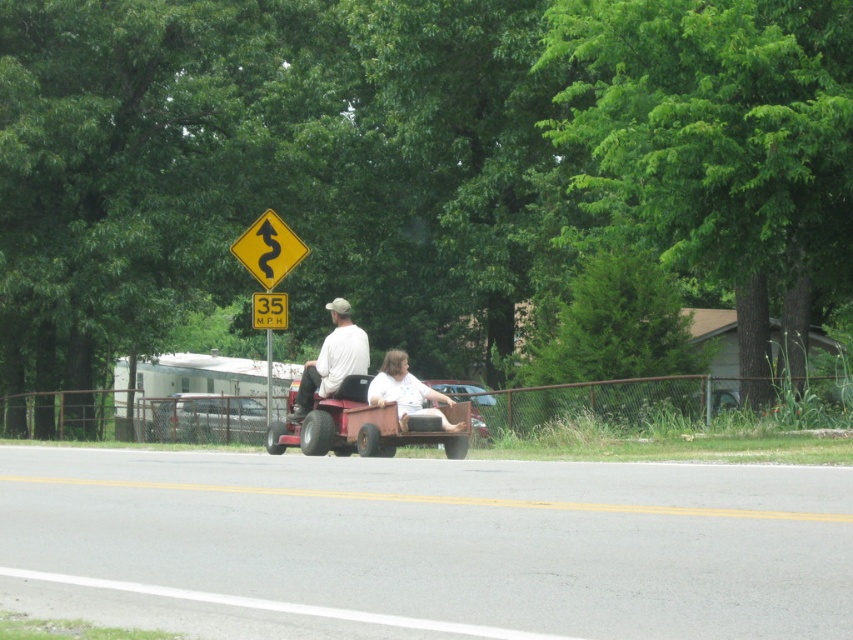
Question: Based on their relative distances, which object is farther from the yellow diamond-shaped road sign at upper center?

Choices:
 (A) white matte shirt at center
 (B) white matte lawn mower at center

Answer: (B)

Question: Estimate the real-world distances between objects in this image. Which object is closer to the yellow diamond-shaped road sign at upper center?

Choices:
 (A) yellowmaterial/texturesign at upper center
 (B) white matte lawn mower at center
 (C) white matte shirt at center

Answer: (A)

Question: Does white matte shirt at center have a larger size compared to white matte lawn mower at center?

Choices:
 (A) yes
 (B) no

Answer: (A)

Question: Is white matte lawn mower at center positioned before metallic silver car at center?

Choices:
 (A) no
 (B) yes

Answer: (B)

Question: Based on their relative distances, which object is farther from the white matte shirt at center?

Choices:
 (A) yellow diamond-shaped road sign at upper center
 (B) silver metallic car at center

Answer: (B)

Question: From the image, what is the correct spatial relationship of rusty metal wagon at center in relation to yellowmaterial/texturesign at upper center?

Choices:
 (A) left
 (B) right

Answer: (B)